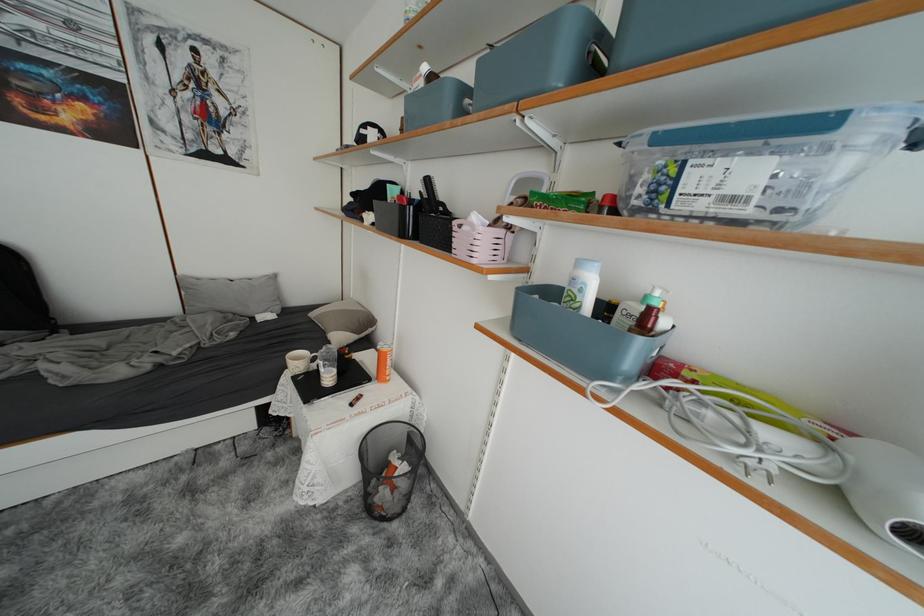
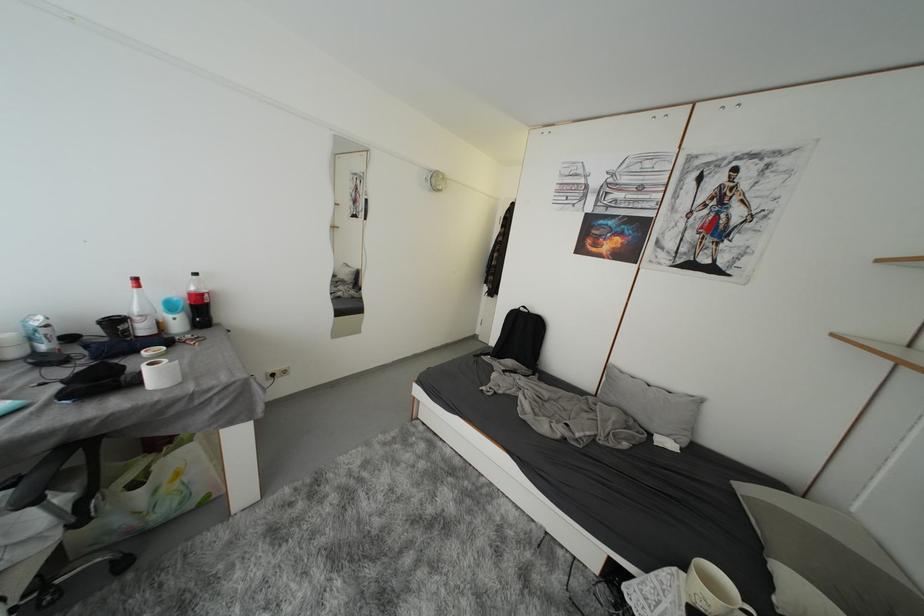
Question: The camera is either moving clockwise (left) or counter-clockwise (right) around the object. The first image is from the beginning of the video and the second image is from the end. Is the camera moving left or right when shooting the video?

Choices:
 (A) Left
 (B) Right

Answer: (B)